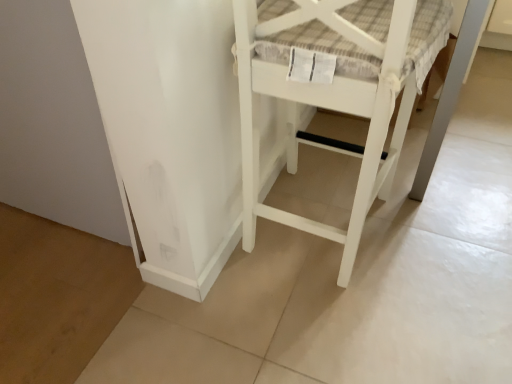
You are a GUI agent. You are given a task and a screenshot of the screen. Output one action in this format:
    pyautogui.click(x=<x>, y=<y>)
    Task: Click on the vacant space underneath white wood chair at center (from a real-world perspective)
    This screenshot has height=384, width=512.
    Given the screenshot: What is the action you would take?
    pyautogui.click(x=322, y=216)